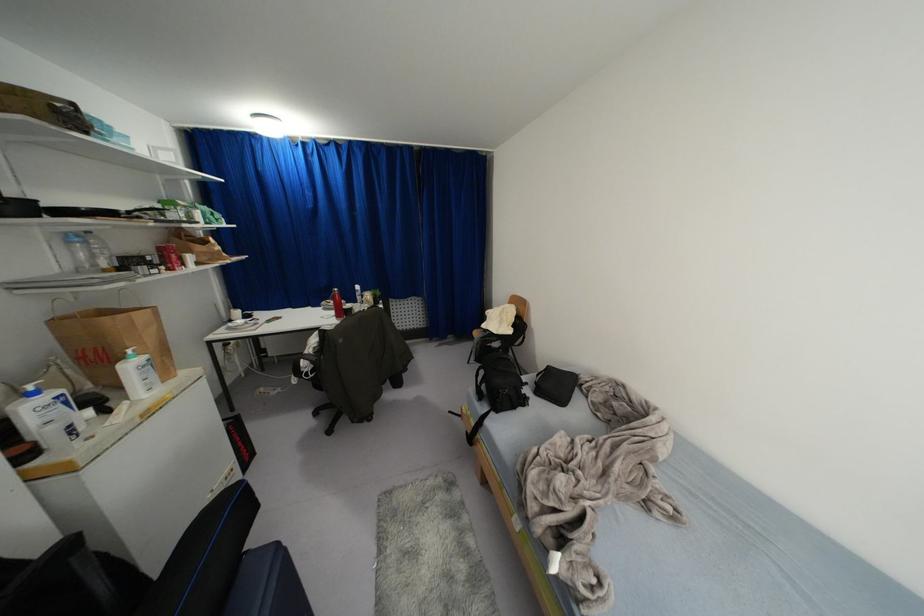
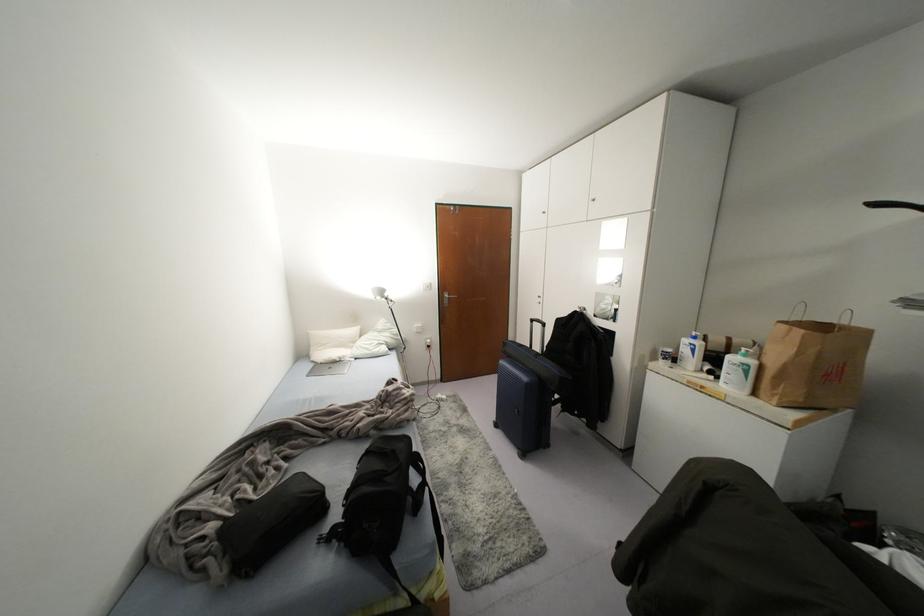
Where in the second image is the point corresponding to pixel 142 355 from the first image?

(751, 362)